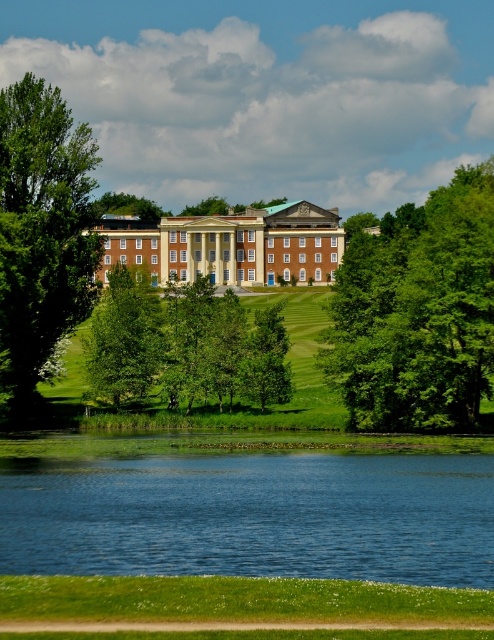
You are standing at the point marked by the coordinates point (41, 230). Looking towards the large classical building on the hill, which direction should you walk to reach the building? Is it north, south, east, or west?

Since the point (41, 230) indicates a green leafy tree at left, you should walk towards the right direction to reach the building. However, without specific cardinal directions in the scene description, we can only infer based on the layout. The building is on the hill, so likely uphill. But the question asks for direction based on the coordinate point. Assuming the coordinate system where 0,0 is the bottom left, then 0.361,0.085 would be near the bottom left. The building is on the hill in the center or